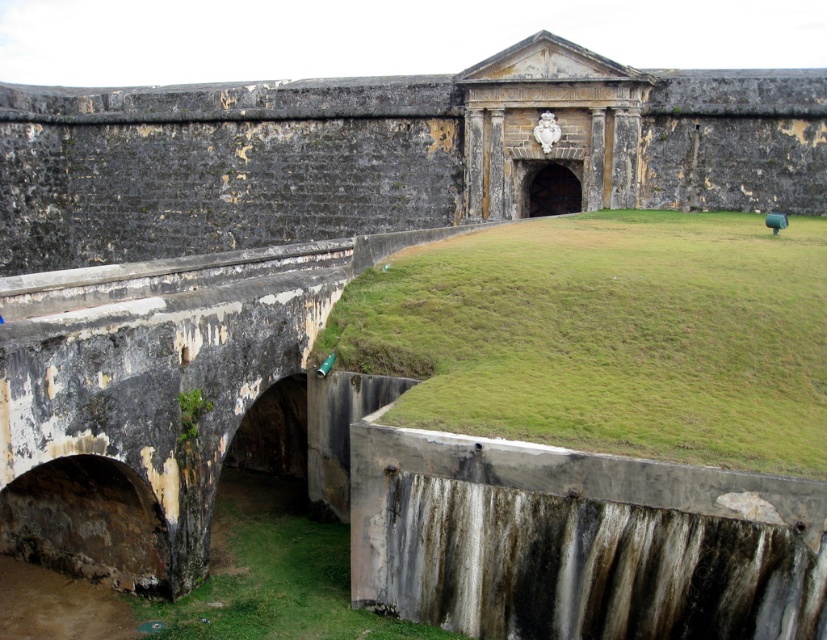
Who is more distant from viewer, (314, 344) or (266, 496)?

Point (266, 496)

Can you confirm if green grass at lower right is positioned below green grass at lower left?

No, green grass at lower right is not below green grass at lower left.

Measure the distance between green grass at lower right and camera.

The distance of green grass at lower right from camera is 28.52 meters.

Identify the location of green grass at lower right. The image size is (827, 640). (606, 337).